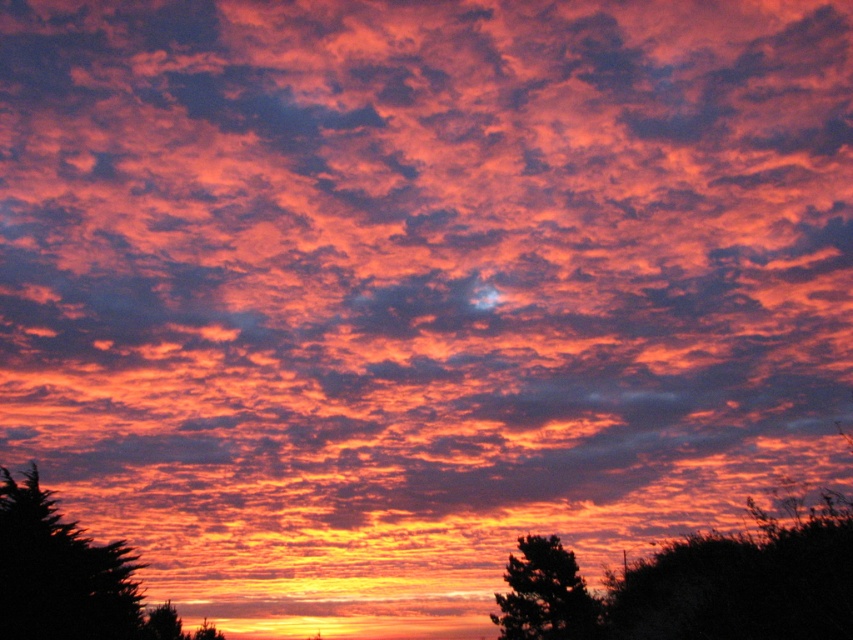
You are an artist trying to paint the sunset scene. You notice a specific point in the image located at coordinates point (68, 577). Based on the scene description, what object is this point likely part of?

The point (68, 577) is on dark green leafy tree at lower left.

You are a photographer trying to capture the sunset. You want to frame the scene so that the dark green leafy tree at lower left and the silhouette tree at lower right are both visible. Which tree should you position closer to the edge of the frame to ensure both fit in the photo?

Since the dark green leafy tree at lower left is narrower than the silhouette tree at lower right, you should position the wider silhouette tree at lower right closer to the edge of the frame to ensure both fit in the photo.